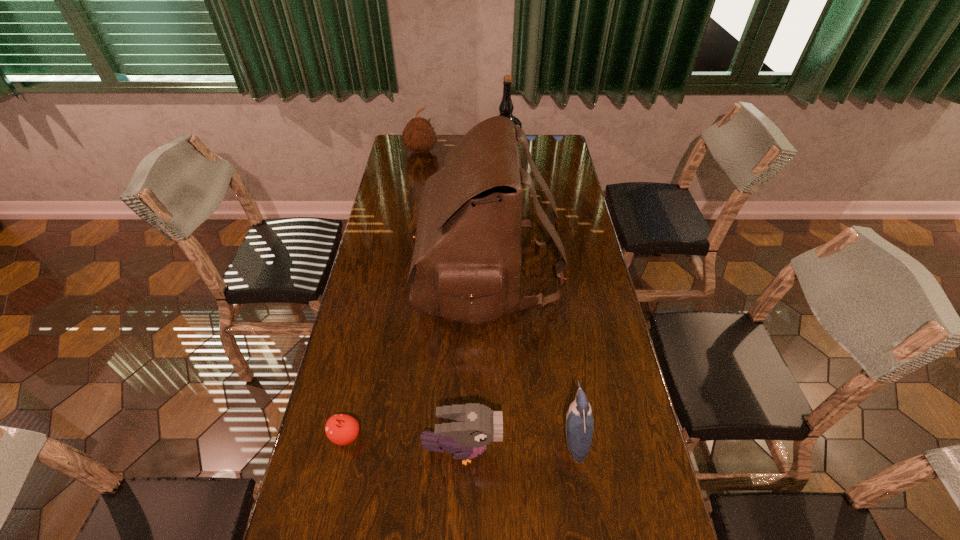
Find the location of a particular element. Image resolution: width=960 pixels, height=540 pixels. the fourth nearest object is located at coordinates (467, 257).

The image size is (960, 540). I want to click on satchel, so click(467, 257).

You are a GUI agent. You are given a task and a screenshot of the screen. Output one action in this format:
    pyautogui.click(x=<x>, y=<y>)
    Task: Click on the second tallest object
    The image size is (960, 540).
    Given the screenshot: What is the action you would take?
    pyautogui.click(x=506, y=107)

This screenshot has height=540, width=960. In order to click on the third tallest object in this screenshot , I will do `click(419, 136)`.

Find the location of a particular element. The height and width of the screenshot is (540, 960). the left bird is located at coordinates (475, 426).

The image size is (960, 540). In order to click on the right bird in this screenshot , I will do `click(579, 421)`.

Where is `apple`? The width and height of the screenshot is (960, 540). apple is located at coordinates (341, 429).

Where is `free location located on the front flap of the fourth nearest object`? The image size is (960, 540). free location located on the front flap of the fourth nearest object is located at coordinates (365, 272).

The height and width of the screenshot is (540, 960). I want to click on vacant space located on the front flap of the fourth nearest object, so click(388, 272).

Image resolution: width=960 pixels, height=540 pixels. What are the coordinates of `free point located 0.050m on the front flap of the fourth nearest object` in the screenshot? It's located at pos(402,272).